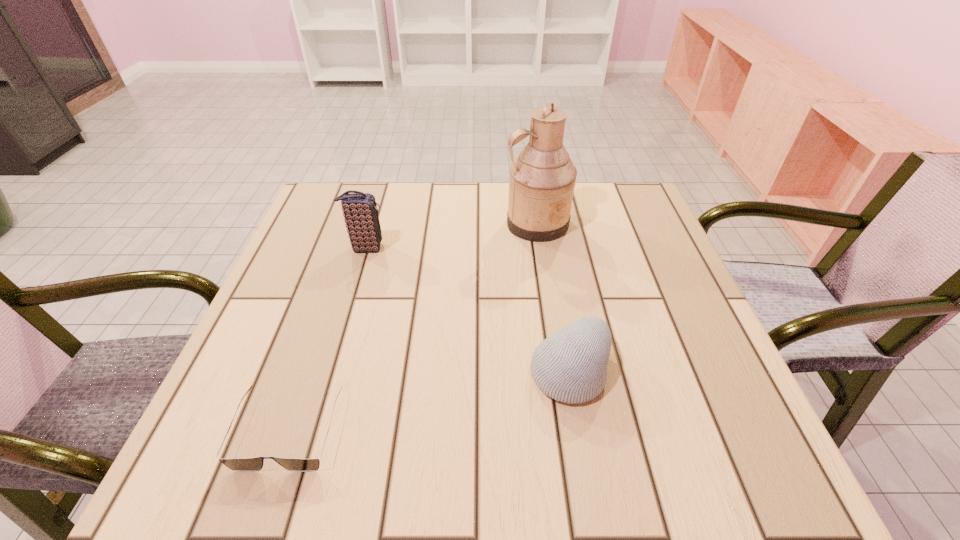
Where is `free space between the pitcher and the beanie`? free space between the pitcher and the beanie is located at coordinates (553, 298).

Find the location of `free space between the shortest object and the second tallest object`. free space between the shortest object and the second tallest object is located at coordinates (327, 339).

The height and width of the screenshot is (540, 960). I want to click on unoccupied area between the beanie and the shortest object, so click(x=430, y=401).

Where is `blank region between the sunglasses and the second shortest object`? The width and height of the screenshot is (960, 540). blank region between the sunglasses and the second shortest object is located at coordinates (430, 401).

You are a GUI agent. You are given a task and a screenshot of the screen. Output one action in this format:
    pyautogui.click(x=<x>, y=<y>)
    Task: Click on the vacant space that is in between the sunglasses and the tallest object
    This screenshot has width=960, height=540.
    Given the screenshot: What is the action you would take?
    pyautogui.click(x=413, y=327)

The image size is (960, 540). Identify the location of free space between the second shortest object and the shortest object. (430, 401).

Find the location of a particular element. This screenshot has width=960, height=540. blank region between the tallest object and the second shortest object is located at coordinates (553, 298).

Image resolution: width=960 pixels, height=540 pixels. Identify the location of free space between the second shortest object and the sunglasses. (430, 401).

Identify which object is the second closest to the second tallest object. Please provide its 2D coordinates. Your answer should be formatted as a tuple, i.e. [(x, y)], where the tuple contains the x and y coordinates of a point satisfying the conditions above.

[(243, 464)]

Identify which object is the second closest to the shortest object. Please provide its 2D coordinates. Your answer should be formatted as a tuple, i.e. [(x, y)], where the tuple contains the x and y coordinates of a point satisfying the conditions above.

[(360, 212)]